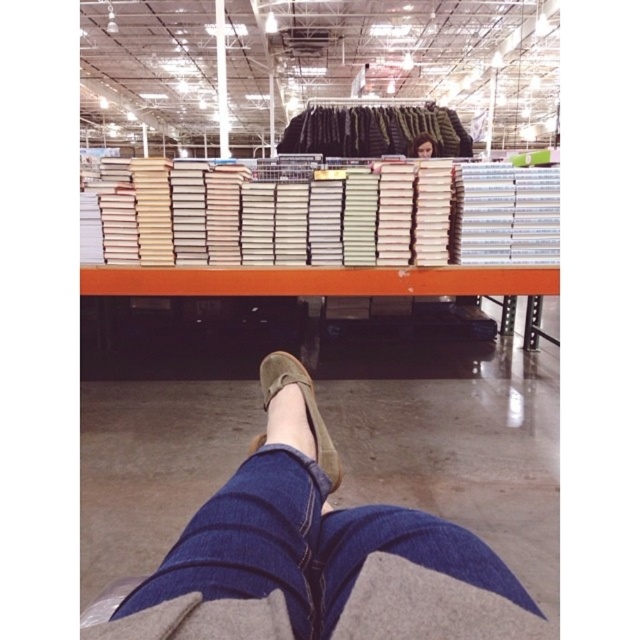
You are standing in the warehouse and see the point marked at coordinates (305, 406). What object is located at that point?

The point at coordinates (305, 406) corresponds to the suede shoe at lower center.

You are standing in the warehouse and see the denim pants at lower center and the smooth brown hair at upper center. Which object is nearer to you?

The denim pants at lower center is closer to the viewer than the smooth brown hair at upper center.

You are standing at the position of the person in the image. Where is the suede shoe at lower center located relative to your current position?

The suede shoe at lower center is located at point 0.636 on the x axis and 0.477 on the y axis relative to your current position.